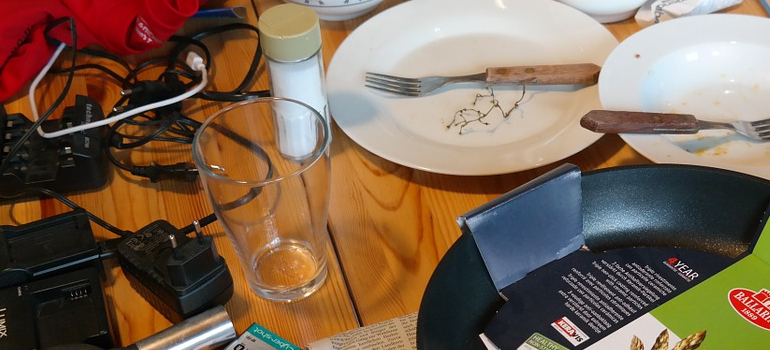
Where is `frying pan`? This screenshot has width=770, height=350. frying pan is located at coordinates (687, 210).